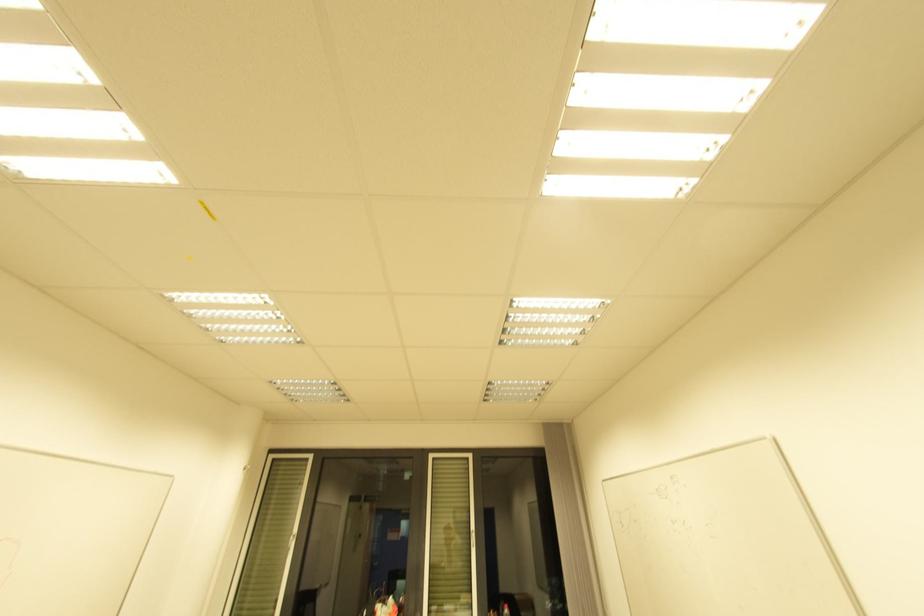
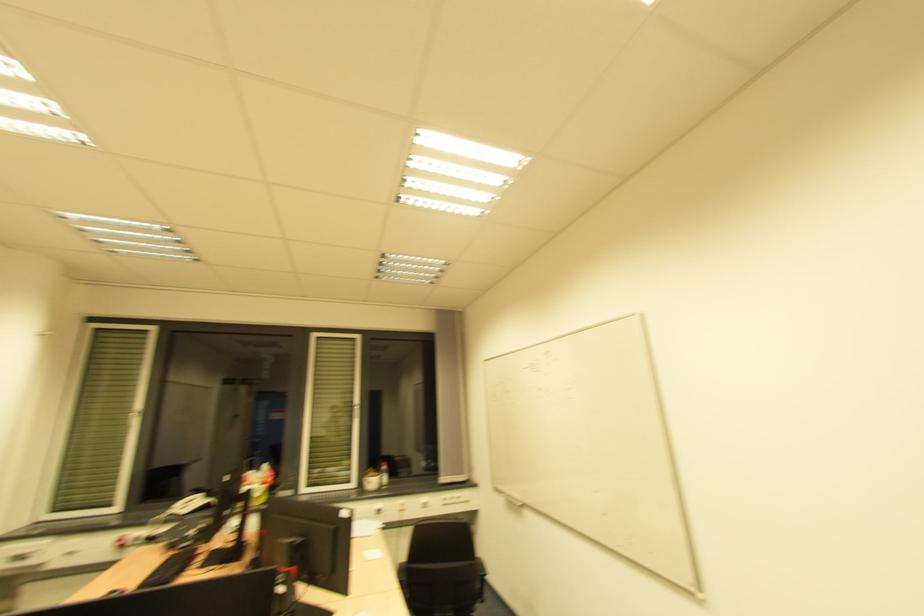
Find the pixel in the second image that matches the point at 433,460 in the first image.

(320, 339)